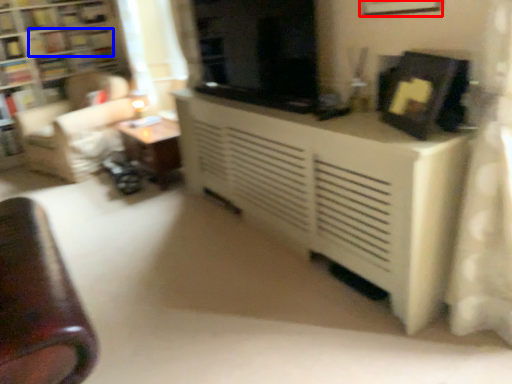
Question: Which of the following is the closest to the observer, picture frame (highlighted by a red box) or book (highlighted by a blue box)?

Choices:
 (A) picture frame
 (B) book

Answer: (A)